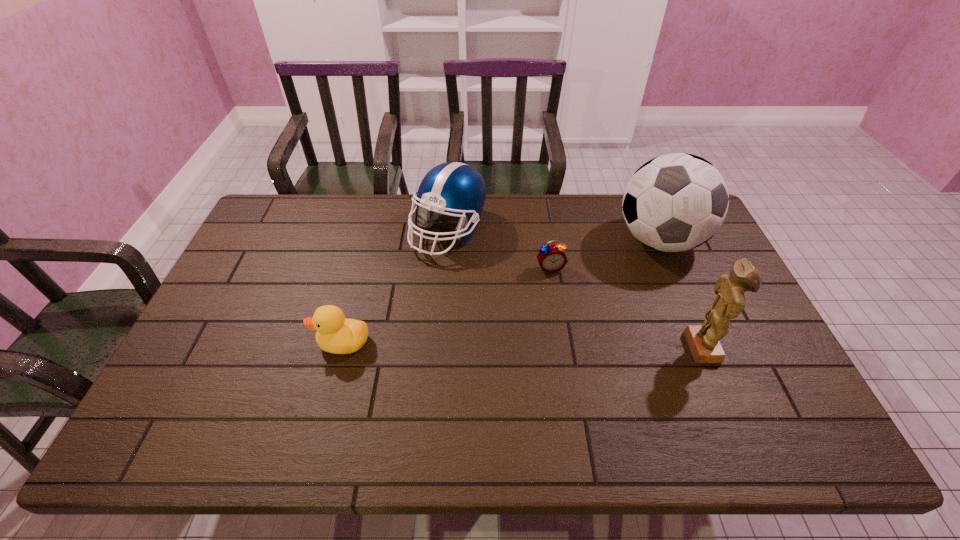
I want to click on vacant space situated 0.170m on the main logo of the soccer ball, so 600,288.

This screenshot has width=960, height=540. I want to click on free space located 0.330m on the main logo of the soccer ball, so click(565, 316).

Locate an element on the screen. This screenshot has height=540, width=960. vacant space located on the main logo of the soccer ball is located at coordinates (549, 329).

The height and width of the screenshot is (540, 960). Identify the location of free point located on the front-facing side of the third object from left to right. (582, 356).

Where is `vacant space located on the front-facing side of the third object from left to right`? The height and width of the screenshot is (540, 960). vacant space located on the front-facing side of the third object from left to right is located at coordinates (558, 286).

You are a GUI agent. You are given a task and a screenshot of the screen. Output one action in this format:
    pyautogui.click(x=<x>, y=<y>)
    Task: Click on the free space located on the front-facing side of the third object from left to right
    This screenshot has height=540, width=960.
    Given the screenshot: What is the action you would take?
    pyautogui.click(x=568, y=318)

Find the location of a particular element. free region located at the front of the second object from left to right with the faceguard is located at coordinates (470, 349).

Find the location of a particular element. The width and height of the screenshot is (960, 540). vacant point located 0.170m at the front of the second object from left to right with the faceguard is located at coordinates (462, 304).

I want to click on vacant area situated at the front of the second object from left to right with the faceguard, so click(x=475, y=372).

Identify the location of soccer ball that is at the far edge. (675, 202).